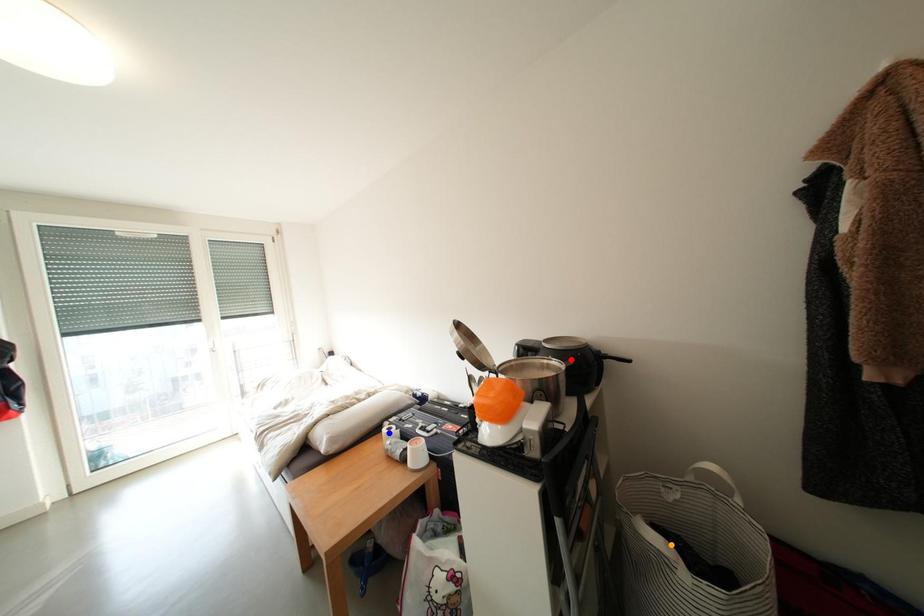
Order these from nearest to farthest:
blue point
red point
orange point

orange point, red point, blue point